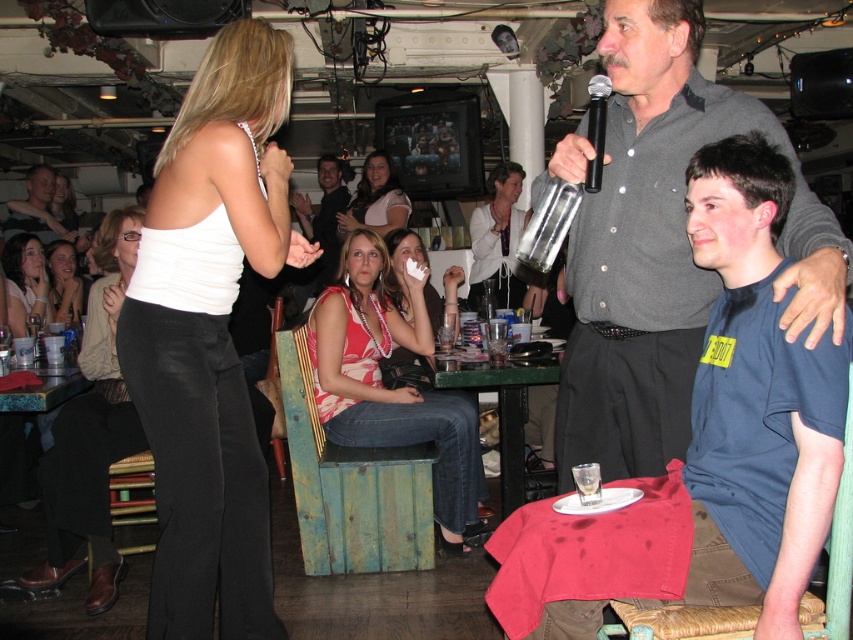
You are standing at the back of the room and want to approach the two points in the image. Which point should you reach first, point (344,230) or point (602,138)?

You should reach point (344,230) first because it is closer to you than point (602,138), which is further away.